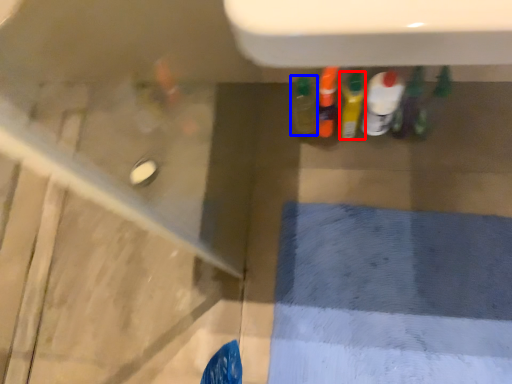
Question: Which object is closer to the camera taking this photo, bottle (highlighted by a red box) or bottle (highlighted by a blue box)?

Choices:
 (A) bottle
 (B) bottle

Answer: (A)